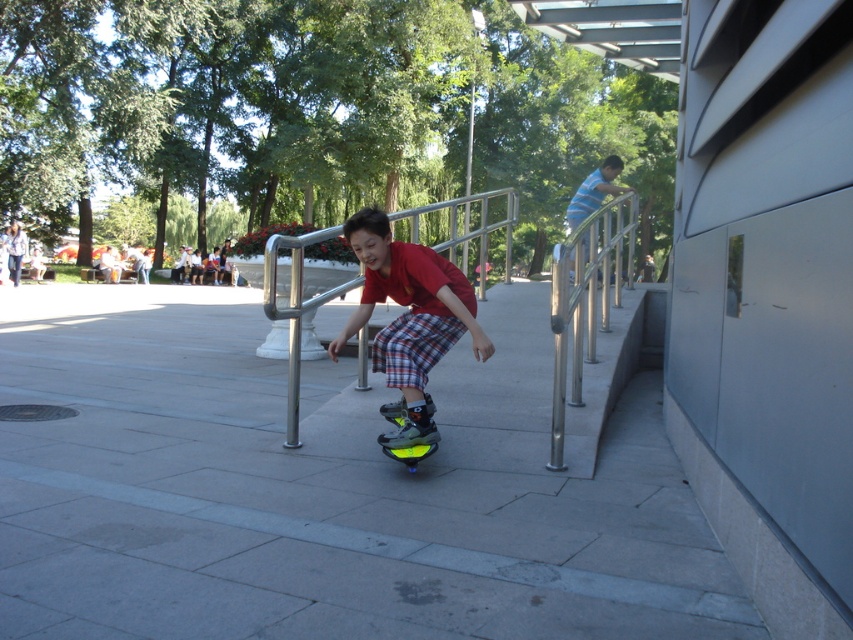
You are a photographer trying to capture the matte red shirt at center and the neon yellow plastic skateboard at center in a single frame. Based on their positions, which object is more likely to be fully visible without any obstruction?

The matte red shirt at center is wider than the neon yellow plastic skateboard at center, so the skateboard might be partially hidden if the shirt is blocking part of the frame. However, since both are at the center, they are likely both visible but the shirt wearer might be in front, making the skateboard slightly less visible.

You are a photographer trying to capture the skateboarder in the park. You notice the matte red shirt at center and the neon yellow plastic skateboard at center. Which object is closer to the camera based on their positions?

The matte red shirt at center is positioned over the neon yellow plastic skateboard at center, meaning it is closer to the camera.

You are standing at the point labeled as point (360, 230) and want to throw a ball to reach point (515, 408). Considering the skateboarder is moving towards the direction of the ball, will the ball land before or after the skateboarder reaches the same spot?

The ball will land after the skateboarder reaches the same spot because point (515, 408) is behind point (360, 230), meaning the skateboarder is moving away from the target point while the ball is thrown towards it.